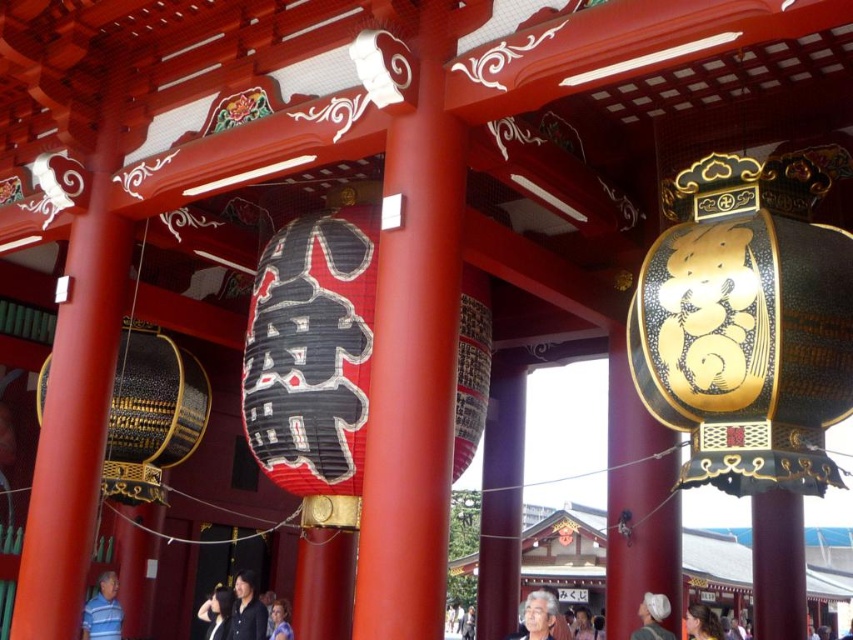
Question: Which is farther from the smooth skin face at center?

Choices:
 (A) dark blue fabric at center
 (B) smooth brown hair at lower right
 (C) matte black shirt at center

Answer: (C)

Question: Which of the following is the closest to the observer?

Choices:
 (A) matte black shirt at center
 (B) smooth red pole at center

Answer: (B)

Question: Can you confirm if black-golden textured lantern at center-right is smaller than blue fabric shirt at center?

Choices:
 (A) yes
 (B) no

Answer: (B)

Question: Can you confirm if blue striped shirt at lower left is wider than matte black shirt at center?

Choices:
 (A) yes
 (B) no

Answer: (B)

Question: Does smooth skin face at center have a greater width compared to matte black shirt at center?

Choices:
 (A) yes
 (B) no

Answer: (B)

Question: Which object is positioned farthest from the white fabric cap at lower center?

Choices:
 (A) black-golden textured lantern at center-right
 (B) blue striped shirt at lower left

Answer: (B)